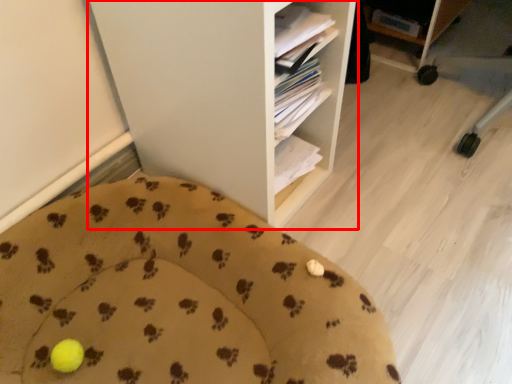
Question: From the image's perspective, what is the correct spatial relationship of shelf (annotated by the red box) in relation to furniture?

Choices:
 (A) above
 (B) below

Answer: (A)